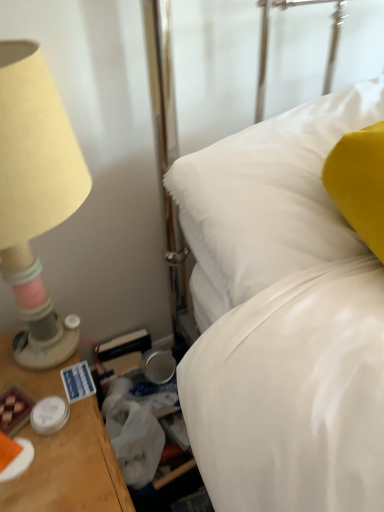
Question: Can you confirm if white satin bed at center is positioned to the left of beige fabric lampshade at left?

Choices:
 (A) yes
 (B) no

Answer: (B)

Question: Does white satin bed at center have a lesser width compared to beige fabric lampshade at left?

Choices:
 (A) yes
 (B) no

Answer: (B)

Question: Does white satin bed at center come behind beige fabric lampshade at left?

Choices:
 (A) yes
 (B) no

Answer: (A)

Question: Could you tell me if white satin bed at center is turned towards beige fabric lampshade at left?

Choices:
 (A) no
 (B) yes

Answer: (A)

Question: Does white satin bed at center have a lesser height compared to beige fabric lampshade at left?

Choices:
 (A) no
 (B) yes

Answer: (B)

Question: Would you say white satin bed at center is outside beige fabric lampshade at left?

Choices:
 (A) yes
 (B) no

Answer: (A)

Question: Is beige fabric lampshade at left positioned in front of white satin bed at center?

Choices:
 (A) yes
 (B) no

Answer: (A)

Question: Is the position of beige fabric lampshade at left more distant than that of white satin bed at center?

Choices:
 (A) no
 (B) yes

Answer: (A)

Question: Does beige fabric lampshade at left have a greater width compared to white satin bed at center?

Choices:
 (A) yes
 (B) no

Answer: (B)

Question: From a real-world perspective, is beige fabric lampshade at left over white satin bed at center?

Choices:
 (A) yes
 (B) no

Answer: (B)

Question: From the image's perspective, would you say beige fabric lampshade at left is positioned over white satin bed at center?

Choices:
 (A) yes
 (B) no

Answer: (B)

Question: Is beige fabric lampshade at left surrounding white satin bed at center?

Choices:
 (A) yes
 (B) no

Answer: (B)

Question: In the image, is beige fabric lampshade at left positioned in front of or behind white satin bed at center?

Choices:
 (A) behind
 (B) front

Answer: (B)